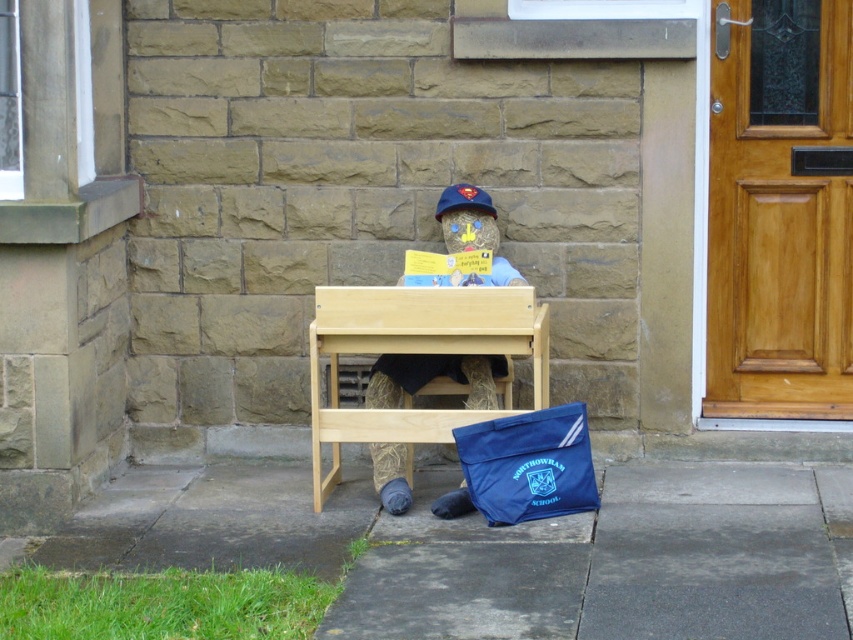
Question: Can you confirm if natural wood table at center is bigger than blue fabric baseball hat at center?

Choices:
 (A) yes
 (B) no

Answer: (A)

Question: Can you confirm if natural wood table at center is wider than blue fabric baseball hat at center?

Choices:
 (A) yes
 (B) no

Answer: (A)

Question: Which point appears closest to the camera in this image?

Choices:
 (A) (397, 307)
 (B) (491, 452)

Answer: (B)

Question: Which point appears farthest from the camera in this image?

Choices:
 (A) (825, 536)
 (B) (363, 310)
 (C) (474, 200)

Answer: (C)

Question: From the image, what is the correct spatial relationship of smooth concrete pavement at lower center in relation to natural wood table at center?

Choices:
 (A) above
 (B) below

Answer: (B)

Question: Among these points, which one is nearest to the camera?

Choices:
 (A) (584, 456)
 (B) (646, 630)
 (C) (434, 342)
 (D) (453, 186)

Answer: (B)